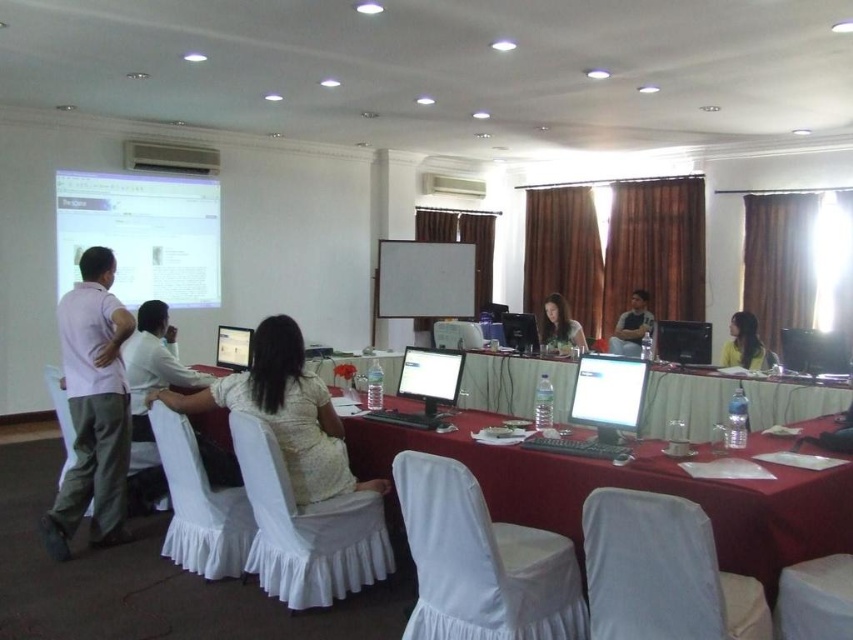
Question: Which point is closer to the camera?

Choices:
 (A) (392, 282)
 (B) (283, 442)
 (C) (419, 422)

Answer: (B)

Question: Which of the following is the closest to the observer?

Choices:
 (A) (422, 390)
 (B) (120, 429)
 (C) (131, 400)

Answer: (B)

Question: Does white matte board at center appear over matte gray shirt at center?

Choices:
 (A) yes
 (B) no

Answer: (A)

Question: Estimate the real-world distances between objects in this image. Which object is closer to the light brown fabric dress at center?

Choices:
 (A) white matte board at center
 (B) white textured dress at center
 (C) white fabric chair at center

Answer: (A)

Question: Can you confirm if white glossy projection screen at upper left is positioned above light brown hair at center?

Choices:
 (A) no
 (B) yes

Answer: (B)

Question: Does white glossy projection screen at upper left lie behind white fabric chair at center?

Choices:
 (A) yes
 (B) no

Answer: (A)